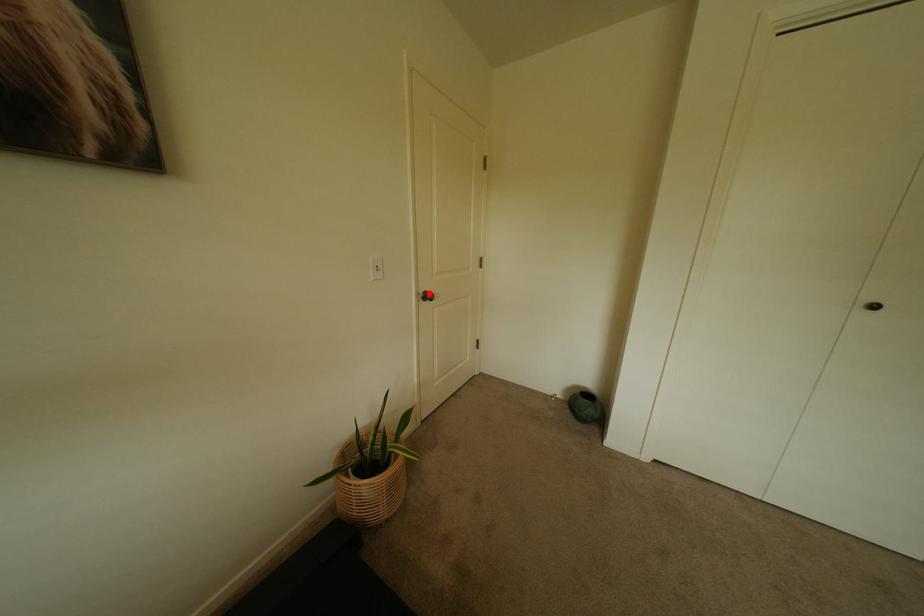
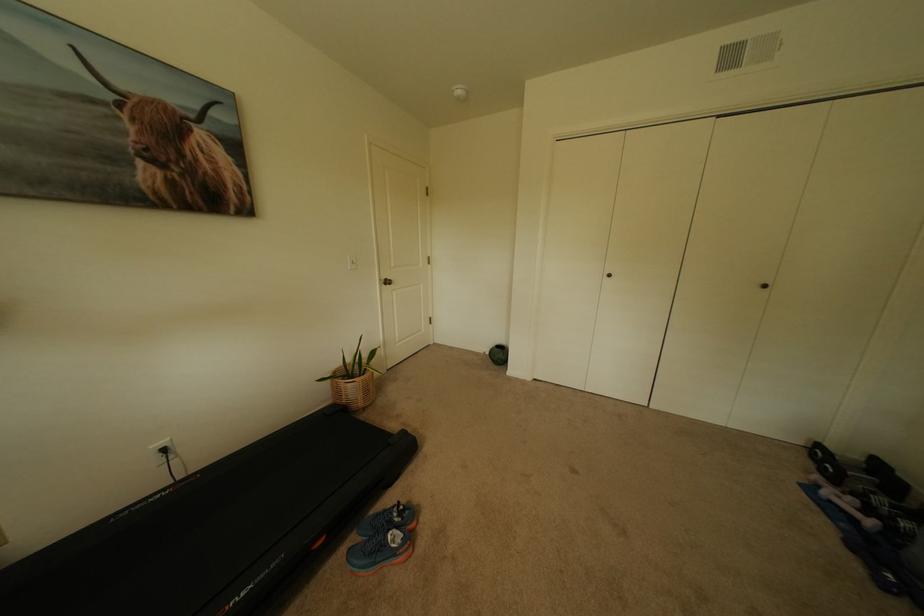
Question: I am providing you with two images of the same scene from different viewpoints. A red point is shown in image1. For the corresponding object point in image2, is it positioned nearer or farther from the camera?

Choices:
 (A) Nearer
 (B) Farther

Answer: (A)